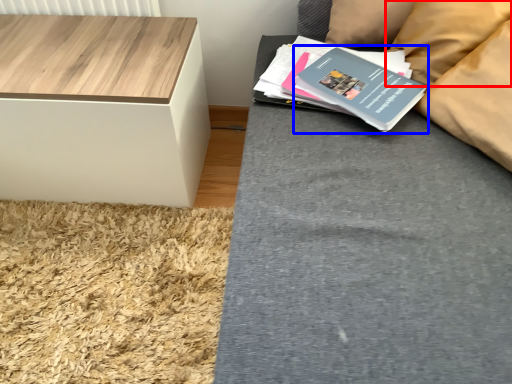
Question: Which object appears closest to the camera in this image, pillow (highlighted by a red box) or paperback book (highlighted by a blue box)?

Choices:
 (A) pillow
 (B) paperback book

Answer: (B)